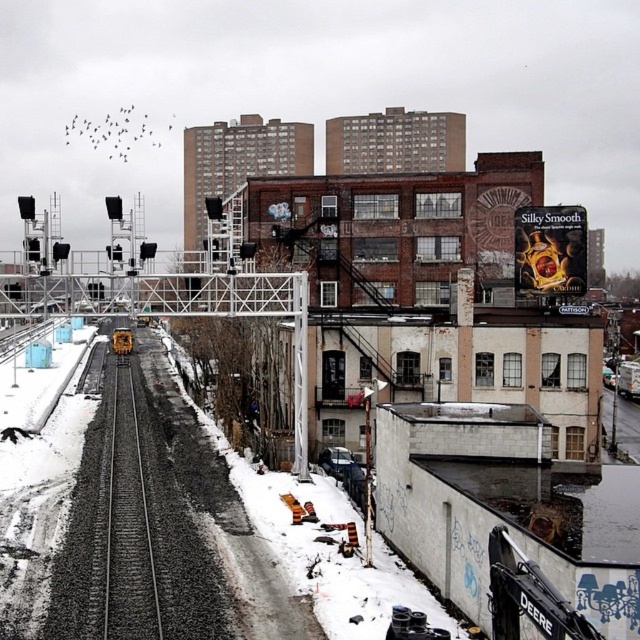
Can you confirm if smooth asphalt train track at center is taller than yellow metallic train at center?

In fact, smooth asphalt train track at center may be shorter than yellow metallic train at center.

Does smooth asphalt train track at center have a lesser width compared to yellow metallic train at center?

Correct, smooth asphalt train track at center's width is less than yellow metallic train at center's.

Does point (156, 579) lie behind point (124, 342)?

No, (156, 579) is closer to viewer.

Identify the location of smooth asphalt train track at center. (128, 524).